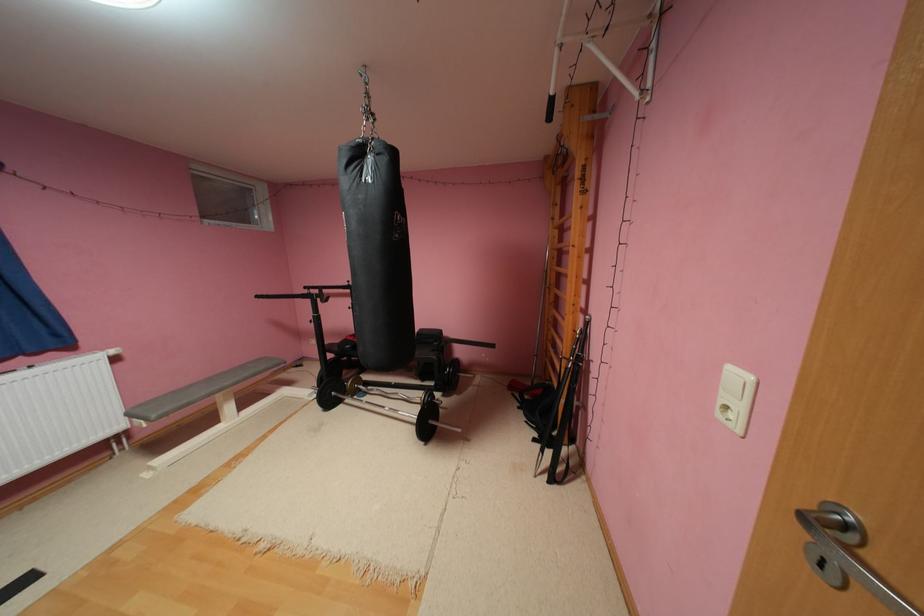
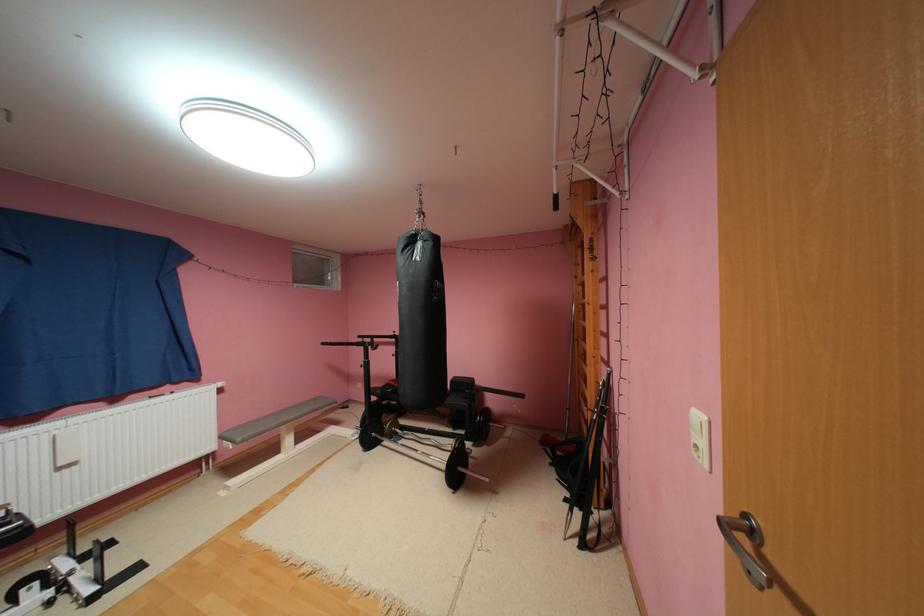
Find the pixel in the second image that matches (x=355, y=284) in the first image.

(400, 334)